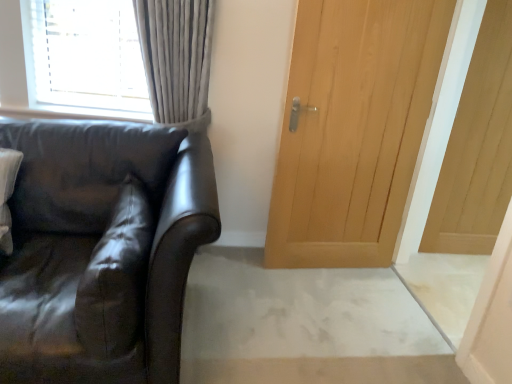
Image resolution: width=512 pixels, height=384 pixels. What do you see at coordinates (477, 147) in the screenshot? I see `light wood paneling at right, positioned as the 1th door in right-to-left order` at bounding box center [477, 147].

Where is `suede-like brown pillow at left`? This screenshot has height=384, width=512. suede-like brown pillow at left is located at coordinates click(116, 277).

Identify the location of light wood paneling at right, positioned as the 1th door in right-to-left order. The width and height of the screenshot is (512, 384). (477, 147).

In the scene shown: Are suede-like brown pillow at left and matte black leather couch at left beside each other?

There is a gap between suede-like brown pillow at left and matte black leather couch at left.

Does suede-like brown pillow at left appear on the left side of matte black leather couch at left?

No, suede-like brown pillow at left is not to the left of matte black leather couch at left.

From a real-world perspective, is suede-like brown pillow at left below matte black leather couch at left?

No.

Can we say suede-like brown pillow at left lies outside matte black leather couch at left?

That's incorrect, suede-like brown pillow at left is not completely outside matte black leather couch at left.

This screenshot has height=384, width=512. I want to click on studio couch below the suede-like brown pillow at left (from a real-world perspective), so click(101, 250).

Measure the distance between matte black leather couch at left and suede-like brown pillow at left.

The distance of matte black leather couch at left from suede-like brown pillow at left is 11.85 centimeters.

Considering the positions of objects matte black leather couch at left and suede-like brown pillow at left in the image provided, who is more to the right, matte black leather couch at left or suede-like brown pillow at left?

suede-like brown pillow at left is more to the right.

How different are the orientations of light wood paneling at right, which is the 2th door in left-to-right order, and suede-like brown pillow at left in degrees?

The angle between the facing direction of light wood paneling at right, which is the 2th door in left-to-right order, and the facing direction of suede-like brown pillow at left is 88.8 degrees.

Which of these two, light wood paneling at right, positioned as the 1th door in right-to-left order, or suede-like brown pillow at left, is bigger?

light wood paneling at right, positioned as the 1th door in right-to-left order.

Which is behind, light wood paneling at right, which is the 2th door in left-to-right order, or suede-like brown pillow at left?

light wood paneling at right, which is the 2th door in left-to-right order, is further from the camera.

From the image's perspective, which is below, light wood paneling at right, which is the 2th door in left-to-right order, or suede-like brown pillow at left?

suede-like brown pillow at left is shown below in the image.

Which of these two, matte black leather couch at left or light wood door at center, acting as the 2th door starting from the right, is thinner?

Thinner between the two is light wood door at center, acting as the 2th door starting from the right.

Is matte black leather couch at left positioned with its back to light wood door at center, acting as the 2th door starting from the right?

That's not correct — matte black leather couch at left is not looking away from light wood door at center, acting as the 2th door starting from the right.

Is matte black leather couch at left bigger or smaller than light wood door at center, acting as the 2th door starting from the right?

matte black leather couch at left is bigger than light wood door at center, acting as the 2th door starting from the right.

Can you confirm if matte black leather couch at left is positioned to the left of light wood door at center, acting as the 2th door starting from the right?

Indeed, matte black leather couch at left is positioned on the left side of light wood door at center, acting as the 2th door starting from the right.

I want to click on studio couch below the light wood paneling at right, positioned as the 1th door in right-to-left order (from the image's perspective), so click(x=101, y=250).

Is light wood paneling at right, which is the 2th door in left-to-right order, far away from matte black leather couch at left?

Indeed, light wood paneling at right, which is the 2th door in left-to-right order, is not near matte black leather couch at left.

Between light wood paneling at right, which is the 2th door in left-to-right order, and matte black leather couch at left, which one appears on the left side from the viewer's perspective?

From the viewer's perspective, matte black leather couch at left appears more on the left side.

Between light wood door at center, the 1th door positioned from the left, and matte black leather couch at left, which one has smaller width?

Thinner between the two is light wood door at center, the 1th door positioned from the left.

Which is more to the right, light wood door at center, acting as the 2th door starting from the right, or matte black leather couch at left?

From the viewer's perspective, light wood door at center, acting as the 2th door starting from the right, appears more on the right side.

Is matte black leather couch at left at the back of light wood door at center, acting as the 2th door starting from the right?

No, light wood door at center, acting as the 2th door starting from the right, is not facing away from matte black leather couch at left.

Is light wood door at center, the 1th door positioned from the left, far away from matte black leather couch at left?

Absolutely, light wood door at center, the 1th door positioned from the left, is distant from matte black leather couch at left.

Consider the image. Are suede-like brown pillow at left and light wood paneling at right, which is the 2th door in left-to-right order, far apart?

suede-like brown pillow at left is positioned a significant distance from light wood paneling at right, which is the 2th door in left-to-right order.

Is suede-like brown pillow at left spatially inside light wood paneling at right, positioned as the 1th door in right-to-left order, or outside of it?

suede-like brown pillow at left exists outside the volume of light wood paneling at right, positioned as the 1th door in right-to-left order.

From the image's perspective, is suede-like brown pillow at left located beneath light wood paneling at right, positioned as the 1th door in right-to-left order?

Indeed, from the image's perspective, suede-like brown pillow at left is shown beneath light wood paneling at right, positioned as the 1th door in right-to-left order.

Considering the positions of objects suede-like brown pillow at left and light wood paneling at right, positioned as the 1th door in right-to-left order, in the image provided, who is more to the left, suede-like brown pillow at left or light wood paneling at right, positioned as the 1th door in right-to-left order,?

Answer: suede-like brown pillow at left.

The width and height of the screenshot is (512, 384). I want to click on studio couch on the left of suede-like brown pillow at left, so click(101, 250).

I want to click on studio couch in front of the suede-like brown pillow at left, so click(101, 250).

From the image, which object appears to be nearer to light wood paneling at right, positioned as the 1th door in right-to-left order, matte black leather couch at left or suede-like brown pillow at left?

matte black leather couch at left lies closer to light wood paneling at right, positioned as the 1th door in right-to-left order, than the other object.

When comparing their distances from light wood door at center, acting as the 2th door starting from the right, does light wood paneling at right, which is the 2th door in left-to-right order, or suede-like brown pillow at left seem closer?

light wood paneling at right, which is the 2th door in left-to-right order, is positioned closer to the anchor light wood door at center, acting as the 2th door starting from the right.

From the image, which object appears to be nearer to suede-like brown pillow at left, light wood paneling at right, positioned as the 1th door in right-to-left order, or light wood door at center, acting as the 2th door starting from the right?

light wood door at center, acting as the 2th door starting from the right, lies closer to suede-like brown pillow at left than the other object.

From the image, which object appears to be nearer to matte black leather couch at left, light wood door at center, the 1th door positioned from the left, or suede-like brown pillow at left?

The object closer to matte black leather couch at left is suede-like brown pillow at left.

From the image, which object appears to be nearer to suede-like brown pillow at left, matte black leather couch at left or light wood door at center, the 1th door positioned from the left?

matte black leather couch at left is positioned closer to the anchor suede-like brown pillow at left.

Looking at the image, which one is located closer to light wood paneling at right, which is the 2th door in left-to-right order, light wood door at center, the 1th door positioned from the left, or suede-like brown pillow at left?

light wood door at center, the 1th door positioned from the left.

Based on their spatial positions, is suede-like brown pillow at left or matte black leather couch at left closer to light wood door at center, the 1th door positioned from the left?

Based on the image, matte black leather couch at left appears to be nearer to light wood door at center, the 1th door positioned from the left.

Looking at the image, which one is located further to suede-like brown pillow at left, matte black leather couch at left or light wood paneling at right, which is the 2th door in left-to-right order?

Based on the image, light wood paneling at right, which is the 2th door in left-to-right order, appears to be further to suede-like brown pillow at left.

I want to click on door between suede-like brown pillow at left and light wood paneling at right, which is the 2th door in left-to-right order, from left to right, so click(353, 129).

Locate an element on the screen. The image size is (512, 384). pillow located between matte black leather couch at left and light wood door at center, acting as the 2th door starting from the right, in the left-right direction is located at coordinates (116, 277).

The width and height of the screenshot is (512, 384). What are the coordinates of `door between matte black leather couch at left and light wood paneling at right, positioned as the 1th door in right-to-left order, from left to right` in the screenshot? It's located at (353, 129).

Where is `pillow situated between matte black leather couch at left and light wood paneling at right, positioned as the 1th door in right-to-left order, from left to right`? The width and height of the screenshot is (512, 384). pillow situated between matte black leather couch at left and light wood paneling at right, positioned as the 1th door in right-to-left order, from left to right is located at coordinates (116, 277).